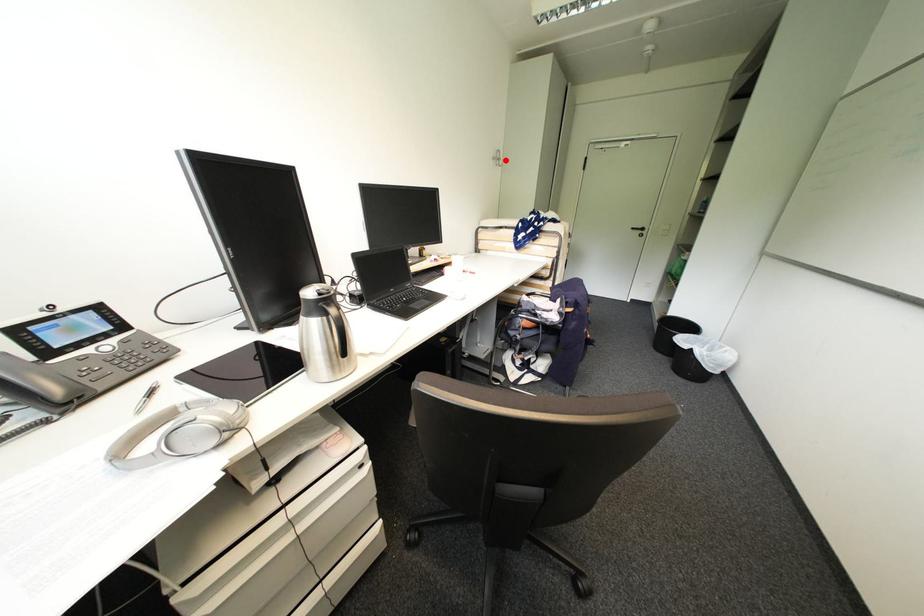
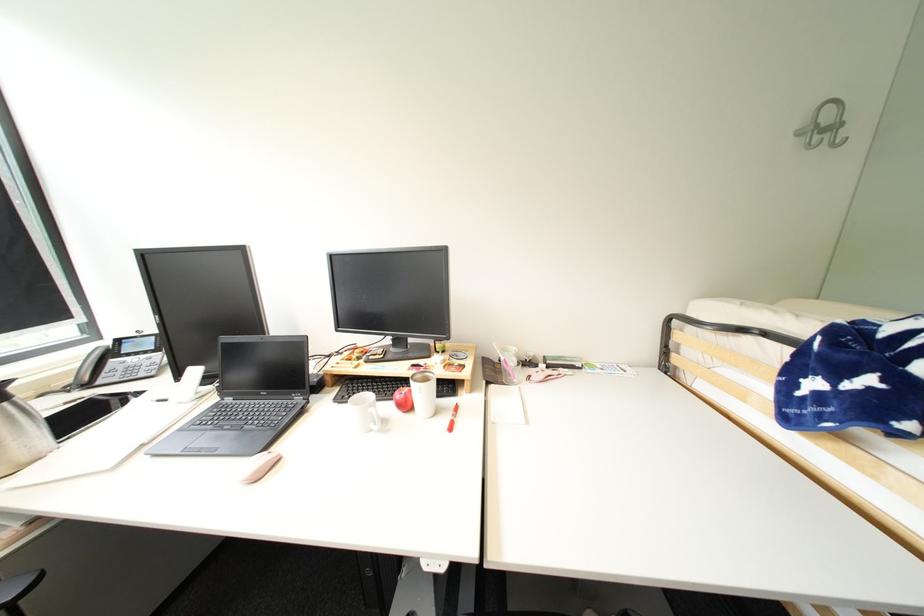
Locate, in the second image, the point that corresponds to the highlighted location in the first image.

(841, 128)